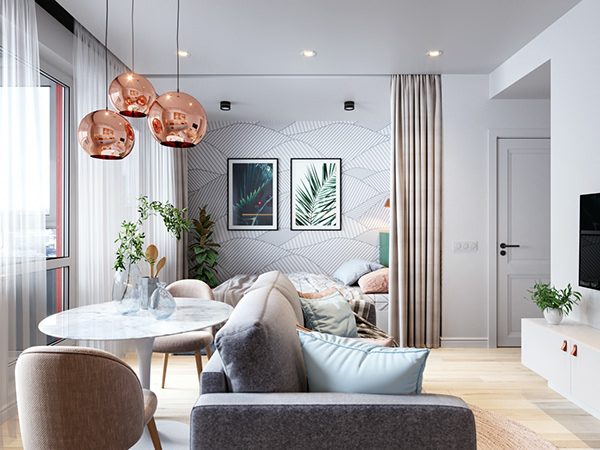
In order to click on white curatin sheers in this screenshot , I will do `click(28, 65)`.